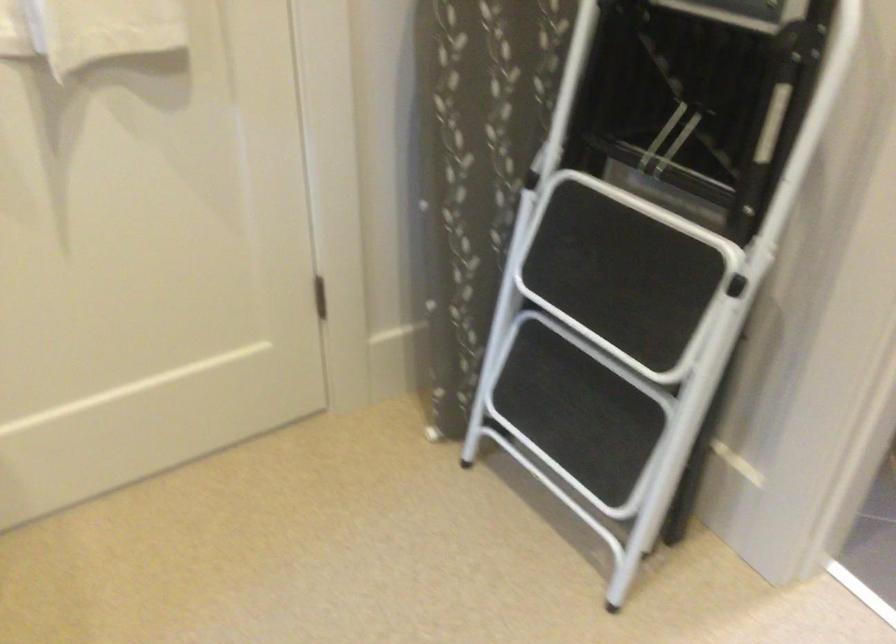
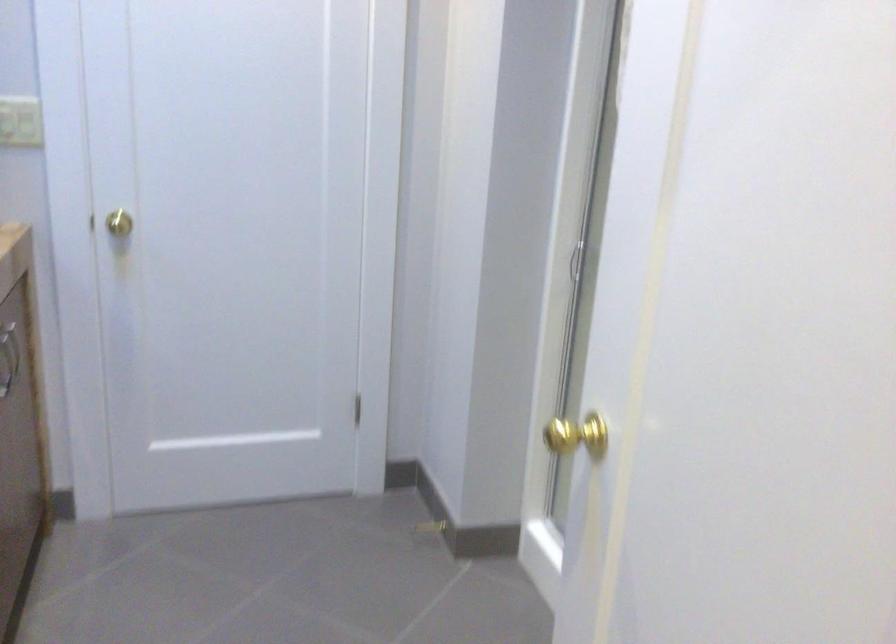
Question: Based on the continuous images, in which direction is the camera rotating? Reply with the corresponding letter.

Choices:
 (A) Left
 (B) Right
 (C) Up
 (D) Down

Answer: (B)